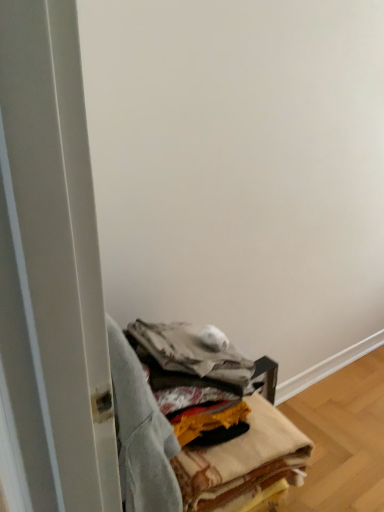
Locate an element on the screen. textured fabric stack at lower center is located at coordinates [190, 448].

Describe the element at coordinates (190, 448) in the screenshot. I see `textured fabric stack at lower center` at that location.

What is the approximate width of textured fabric stack at lower center?

17.37 inches.

I want to click on textured fabric stack at lower center, so tap(190, 448).